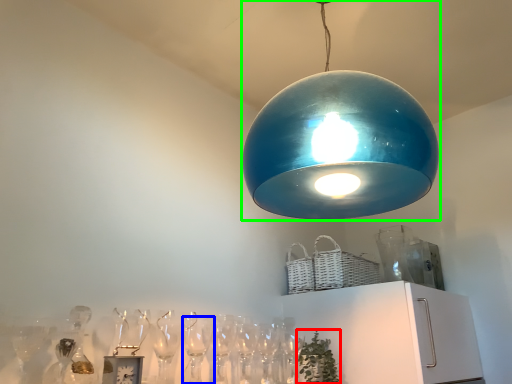
Question: Which object is positioned closest to plant (highlighted by a red box)? Select from wine glass (highlighted by a blue box) and lamp (highlighted by a green box).

Choices:
 (A) wine glass
 (B) lamp

Answer: (A)